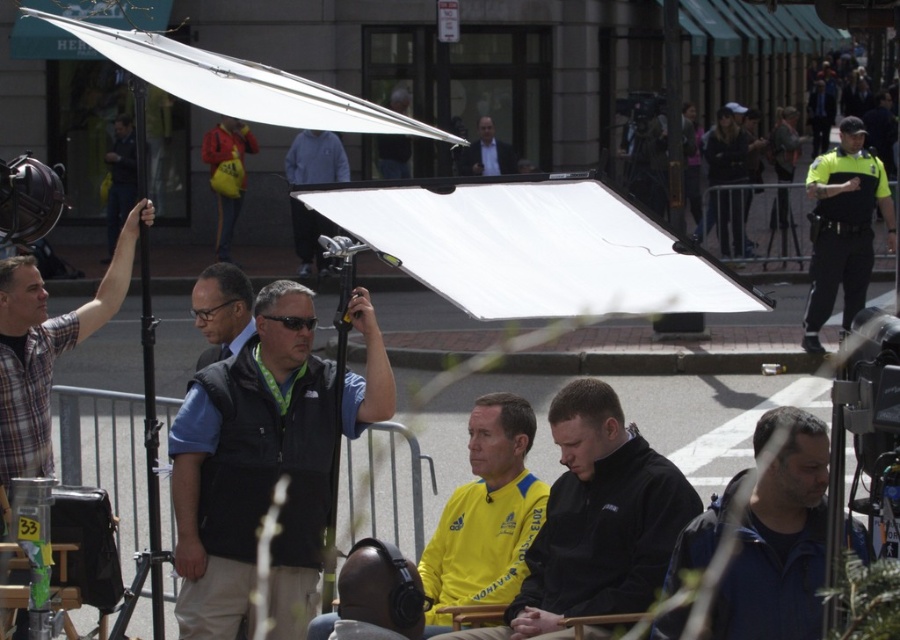
Question: Does dark blue jacket at lower right have a smaller size compared to plaid shirt at left?

Choices:
 (A) yes
 (B) no

Answer: (B)

Question: Does plaid shirt at left lie in front of yellow jacket at center?

Choices:
 (A) yes
 (B) no

Answer: (A)

Question: Which point appears closest to the camera in this image?

Choices:
 (A) (792, 573)
 (B) (472, 141)
 (C) (478, 406)
 (D) (122, 184)

Answer: (A)

Question: Which point appears closest to the camera in this image?

Choices:
 (A) (105, 257)
 (B) (338, 582)

Answer: (B)

Question: Which point is closer to the camera taking this photo?

Choices:
 (A) (434, 614)
 (B) (508, 148)
 (C) (648, 596)

Answer: (C)

Question: Can you confirm if black fabric vest at center is smaller than yellow fabric shirt at center?

Choices:
 (A) yes
 (B) no

Answer: (B)